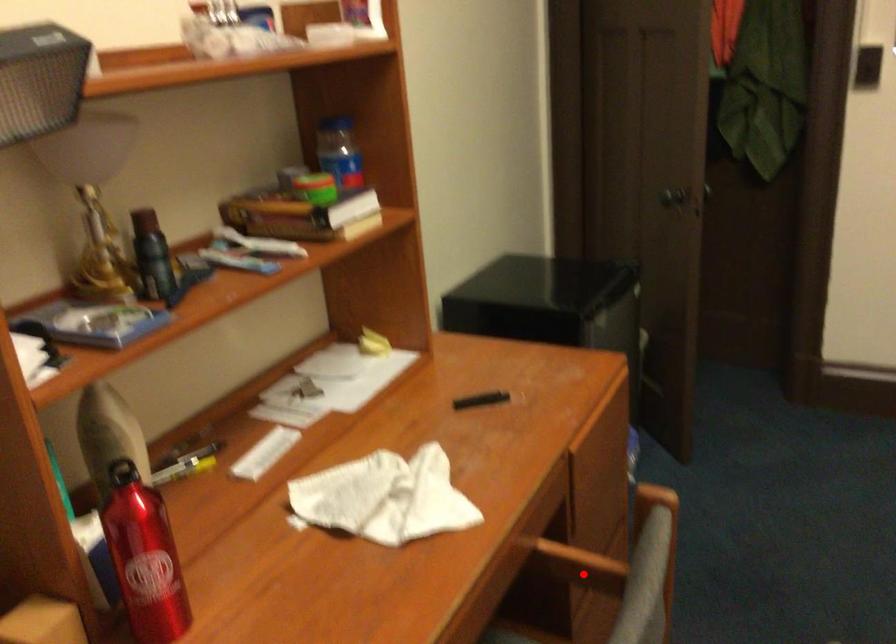
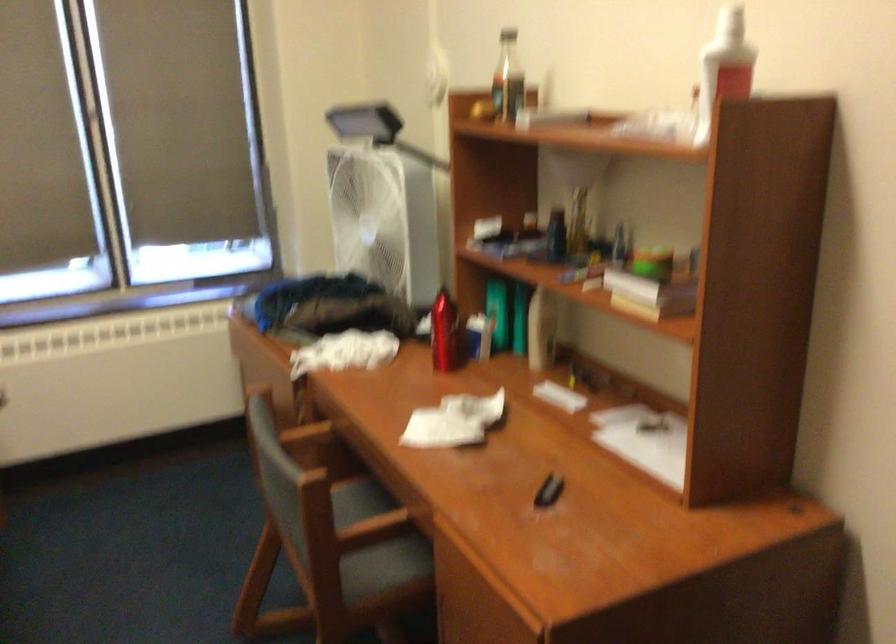
Question: I am providing you with two images of the same scene from different viewpoints. Given a red point in image1, look at the same physical point in image2. Is it:

Choices:
 (A) Closer to the viewpoint
 (B) Farther from the viewpoint

Answer: (B)